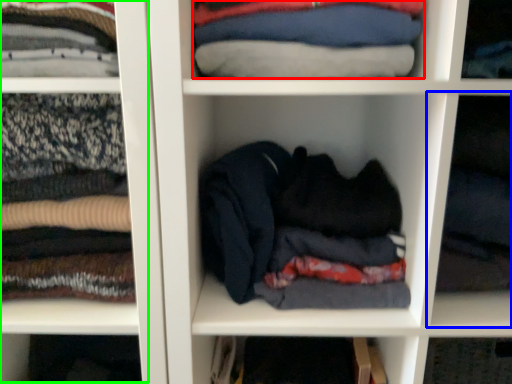
Question: Based on their relative distances, which object is nearer to clothing (highlighted by a red box)? Choose from cabinet (highlighted by a blue box) and cabinet (highlighted by a green box).

Choices:
 (A) cabinet
 (B) cabinet

Answer: (B)